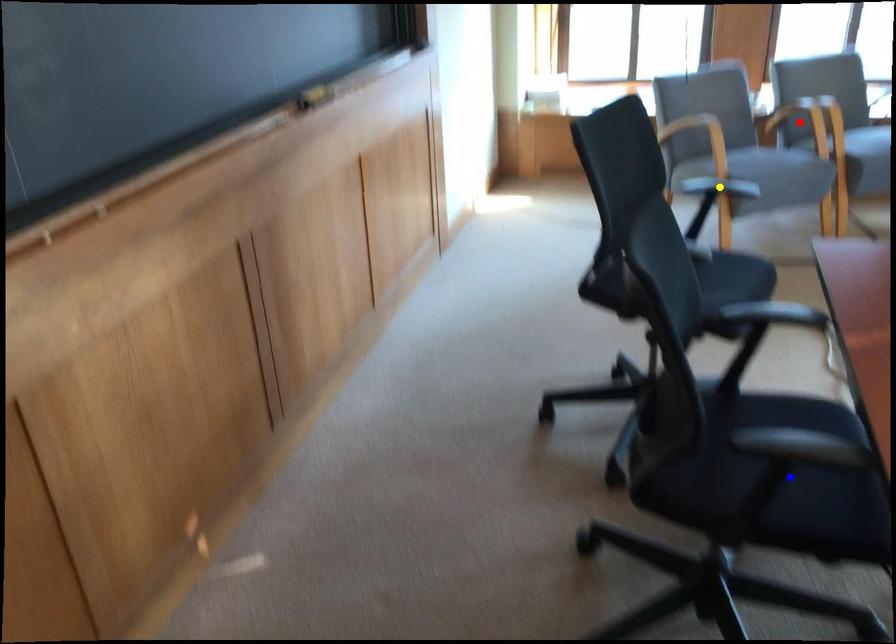
Order these from nearest to farthest:
red point | yellow point | blue point

blue point → yellow point → red point